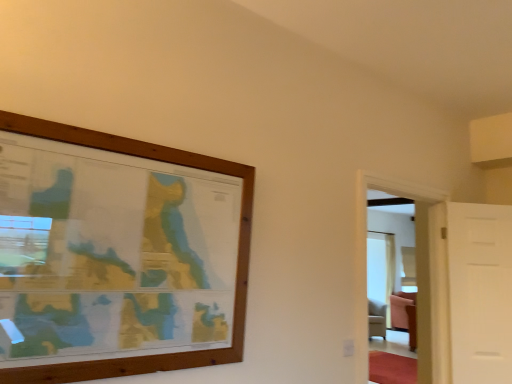
Locate an element on the screen. This screenshot has width=512, height=384. transparent glass door at right is located at coordinates click(x=405, y=245).

What do you see at coordinates (405, 245) in the screenshot?
I see `transparent glass door at right` at bounding box center [405, 245].

What is the approximate height of transparent glass door at right?

It is 4.36 feet.

Describe the element at coordinates (480, 292) in the screenshot. I see `white matte door at right` at that location.

Find the location of a particular element. Image resolution: width=512 pixels, height=384 pixels. white matte door at right is located at coordinates (480, 292).

Measure the distance between white matte door at right and camera.

white matte door at right and camera are 8.81 feet apart.

This screenshot has height=384, width=512. Find the location of `transparent glass door at right`. transparent glass door at right is located at coordinates (405, 245).

Considering the relative positions of transparent glass door at right and white matte door at right in the image provided, is transparent glass door at right to the right of white matte door at right from the viewer's perspective?

No.

Is the position of transparent glass door at right less distant than that of white matte door at right?

That is True.

Does point (362, 293) appear closer or farther from the camera than point (511, 269)?

Point (362, 293) is positioned closer to the camera compared to point (511, 269).

Based on the photo, from the image's perspective, would you say transparent glass door at right is positioned over white matte door at right?

Yes, from the image's perspective, transparent glass door at right is on top of white matte door at right.

From a real-world perspective, is transparent glass door at right on white matte door at right?

Correct, in the physical world, transparent glass door at right is higher than white matte door at right.

Does transparent glass door at right have a lesser width compared to white matte door at right?

No.

Does transparent glass door at right have a greater height compared to white matte door at right?

Yes, transparent glass door at right is taller than white matte door at right.

Looking at the image, does transparent glass door at right seem bigger or smaller compared to white matte door at right?

Clearly, transparent glass door at right is larger in size than white matte door at right.

Would you say transparent glass door at right is outside white matte door at right?

Absolutely, transparent glass door at right is external to white matte door at right.

Are transparent glass door at right and white matte door at right making contact?

No, transparent glass door at right is not touching white matte door at right.

Is white matte door at right at the back of transparent glass door at right?

No, transparent glass door at right is not facing away from white matte door at right.

How far apart are transparent glass door at right and white matte door at right?

transparent glass door at right is 30.04 inches from white matte door at right.

The height and width of the screenshot is (384, 512). I want to click on glass door above the white matte door at right (from a real-world perspective), so click(405, 245).

Is white matte door at right at the right side of transparent glass door at right?

Yes.

Which object is further away from the camera taking this photo, white matte door at right or transparent glass door at right?

white matte door at right is further from the camera.

Is point (510, 220) closer or farther from the camera than point (395, 235)?

Clearly, point (510, 220) is closer to the camera than point (395, 235).

From the image's perspective, between white matte door at right and transparent glass door at right, who is located below?

From the image's view, white matte door at right is below.

From a real-world perspective, which object rests below the other?

white matte door at right is physically lower.

Can you confirm if white matte door at right is wider than transparent glass door at right?

Incorrect, the width of white matte door at right does not surpass that of transparent glass door at right.

Who is taller, white matte door at right or transparent glass door at right?

Standing taller between the two is transparent glass door at right.

From the picture: Between white matte door at right and transparent glass door at right, which one has smaller size?

Smaller between the two is white matte door at right.

Is transparent glass door at right completely or partially inside white matte door at right?

Actually, transparent glass door at right is outside white matte door at right.

Are white matte door at right and transparent glass door at right located far from each other?

That's not correct — white matte door at right is a little close to transparent glass door at right.

Is white matte door at right facing towards transparent glass door at right?

No, white matte door at right is not oriented towards transparent glass door at right.

What's the angular difference between white matte door at right and transparent glass door at right's facing directions?

32.9 degrees.

Image resolution: width=512 pixels, height=384 pixels. In order to click on door to the right of transparent glass door at right in this screenshot , I will do `click(480, 292)`.

Identify the location of glass door above the white matte door at right (from the image's perspective). The height and width of the screenshot is (384, 512). (405, 245).

This screenshot has height=384, width=512. What are the coordinates of `door below the transparent glass door at right (from the image's perspective)` in the screenshot? It's located at (480, 292).